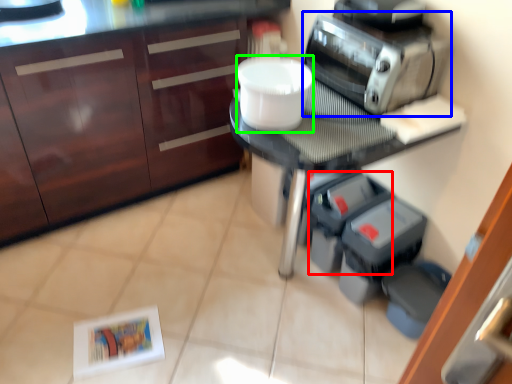
Question: Which object is the closest to the appliance (highlighted by a red box)? Choose among these: home appliance (highlighted by a blue box) or toilet bowl (highlighted by a green box).

Choices:
 (A) home appliance
 (B) toilet bowl

Answer: (A)